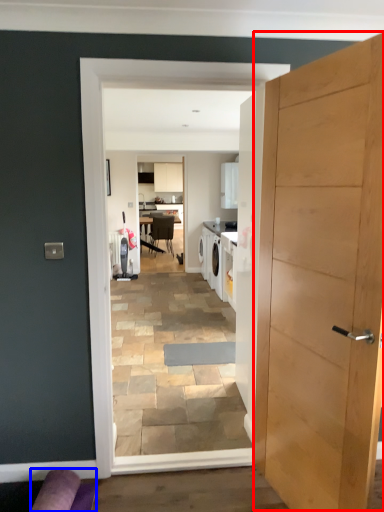
Question: Which object appears closest to the camera in this image, door (highlighted by a red box) or couch (highlighted by a blue box)?

Choices:
 (A) door
 (B) couch

Answer: (A)